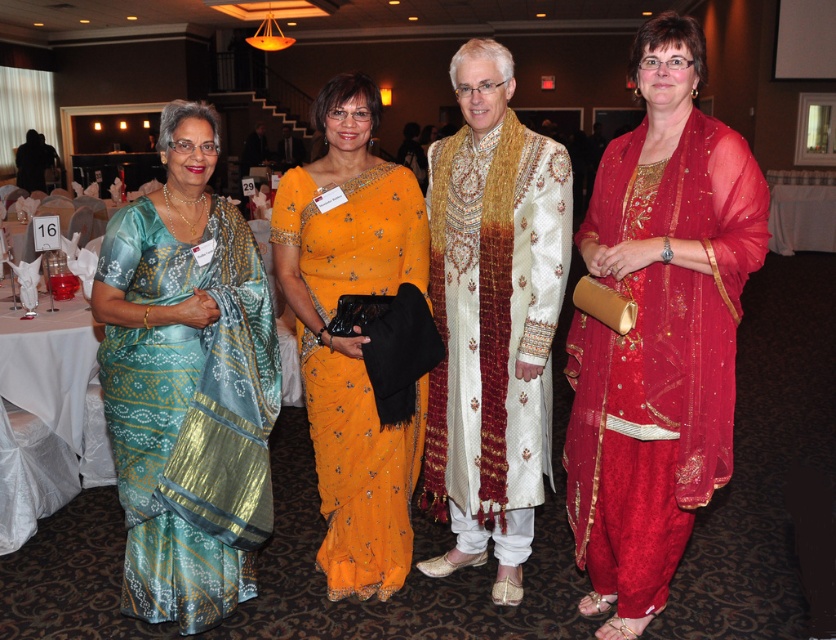
Is red sheer dupatta at center positioned behind white silk sherwani at center?

No, it is in front of white silk sherwani at center.

Who is more distant from viewer, (585, 440) or (517, 307)?

Positioned behind is point (517, 307).

The height and width of the screenshot is (640, 836). Find the location of `red sheer dupatta at center`. red sheer dupatta at center is located at coordinates (658, 330).

Which is above, red sheer dupatta at center or orange silk saree at center?

red sheer dupatta at center is above.

Between red sheer dupatta at center and orange silk saree at center, which one has less height?

orange silk saree at center is shorter.

This screenshot has height=640, width=836. Describe the element at coordinates (658, 330) in the screenshot. I see `red sheer dupatta at center` at that location.

At what (x,y) coordinates should I click in order to perform the action: click on red sheer dupatta at center. Please return your answer as a coordinate pair (x, y). Looking at the image, I should click on (658, 330).

Who is shorter, red sheer dupatta at center or teal silk saree at left?

teal silk saree at left is shorter.

Is red sheer dupatta at center further to the viewer compared to teal silk saree at left?

No, red sheer dupatta at center is in front of teal silk saree at left.

This screenshot has width=836, height=640. I want to click on red sheer dupatta at center, so click(658, 330).